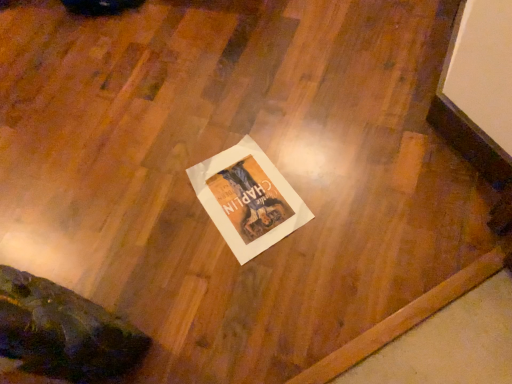
Where is `free space above white paper poster at center (from a real-world perspective)`? The image size is (512, 384). free space above white paper poster at center (from a real-world perspective) is located at coordinates (246, 193).